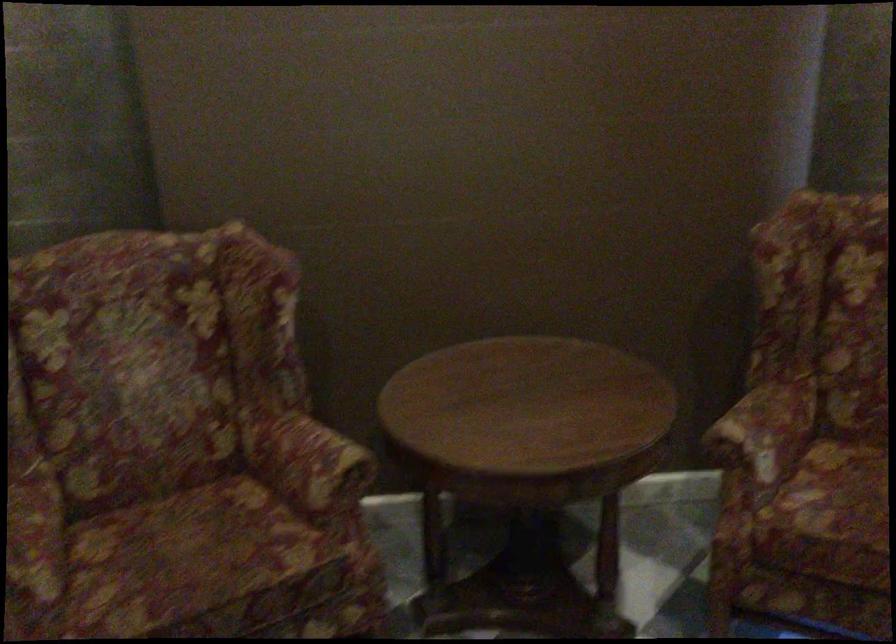
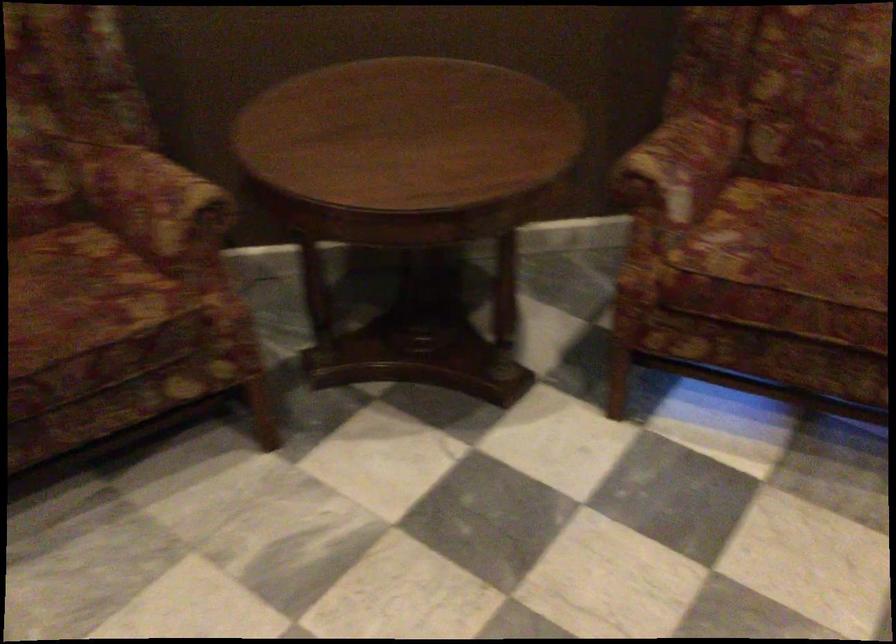
Locate, in the second image, the point that corresponds to point (767, 429) in the first image.

(679, 164)